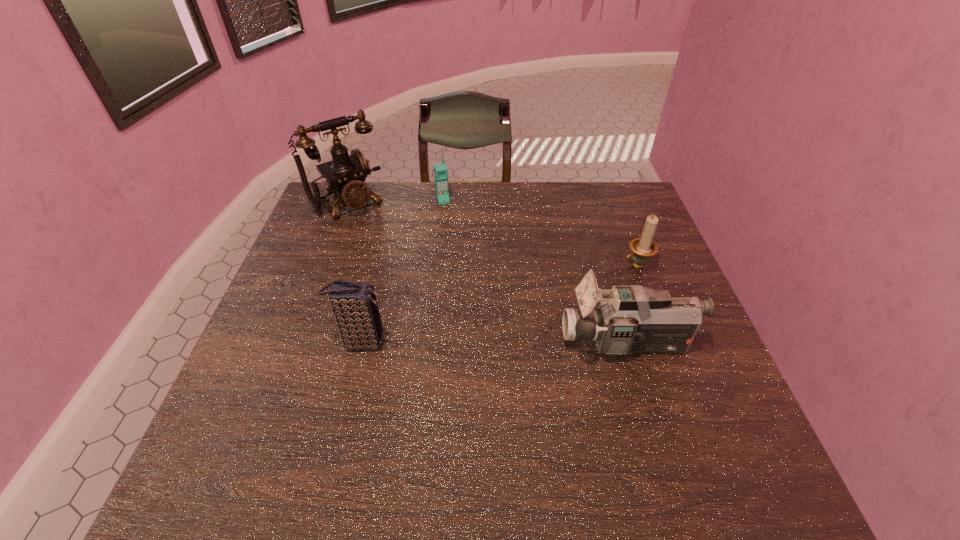
At what (x,y) coordinates should I click in order to perform the action: click on the closest object to the camcorder. Please return your answer as a coordinate pair (x, y). This screenshot has height=540, width=960. Looking at the image, I should click on (643, 248).

Locate which object ranks third in proximity to the third object from left to right. Please provide its 2D coordinates. Your answer should be formatted as a tuple, i.e. [(x, y)], where the tuple contains the x and y coordinates of a point satisfying the conditions above.

[(643, 248)]